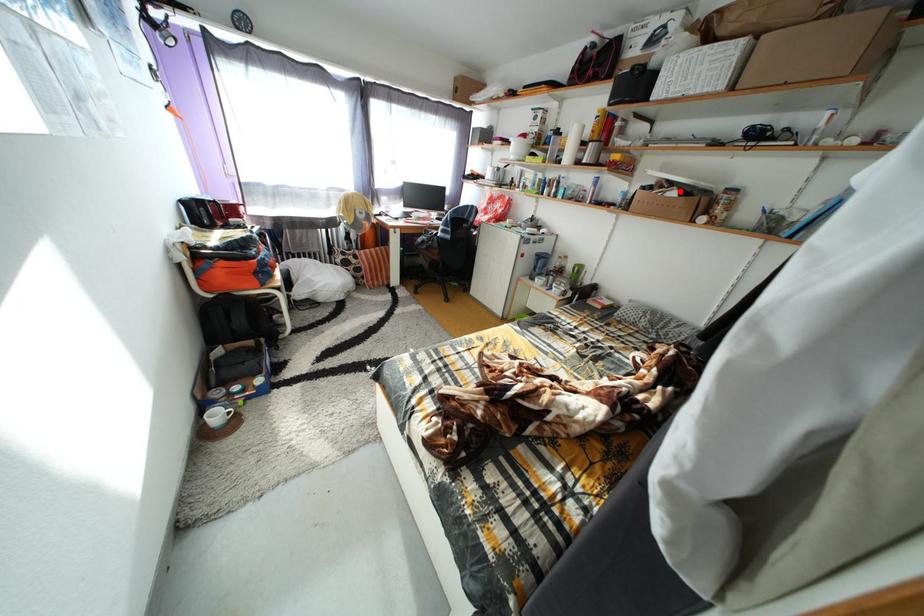
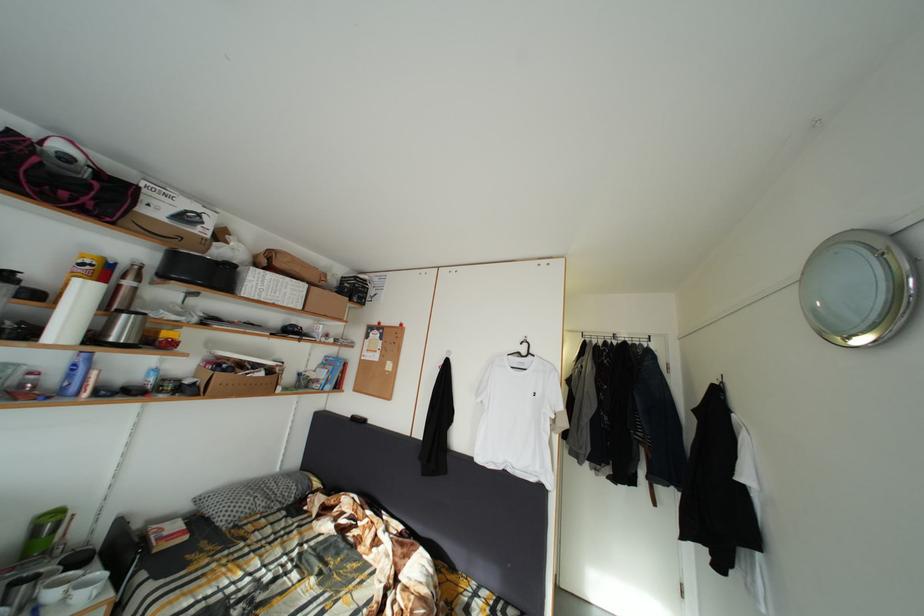
Locate, in the second image, the point that corresponds to the highlighted location in the first image.

(264, 373)